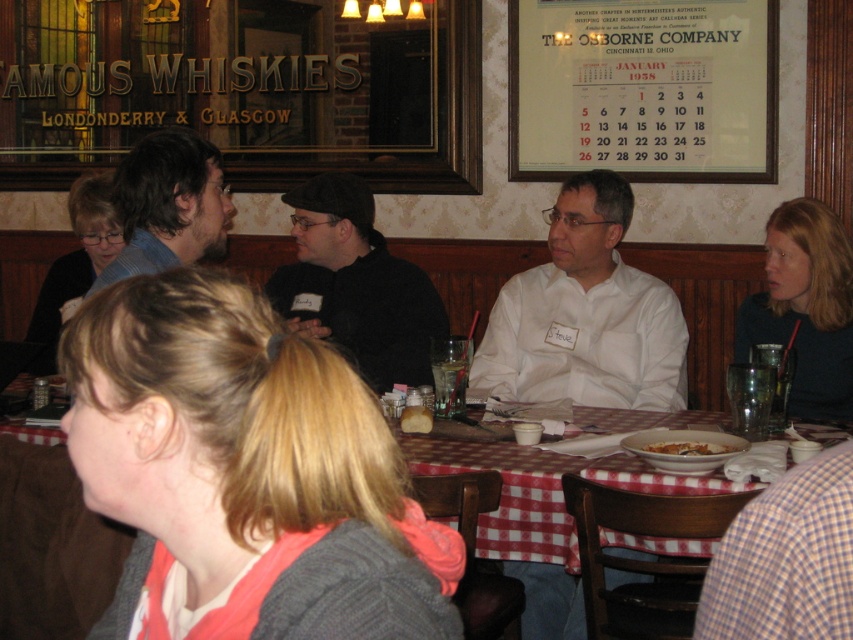
Between point (804, 308) and point (148, 172), which one is positioned in front?

Positioned in front is point (148, 172).

Is point (791, 200) closer to viewer compared to point (151, 266)?

That is False.

Where is `dark blue sweater at right`? This screenshot has height=640, width=853. dark blue sweater at right is located at coordinates (805, 307).

Is red checkered tablecloth at center positioned before white matte bowl at center?

Yes, it is.

Locate an element on the screen. This screenshot has height=640, width=853. red checkered tablecloth at center is located at coordinates (544, 492).

Who is higher up, dark blue sweater at right or white creamy soup at center?

dark blue sweater at right is higher up.

Can you confirm if dark blue sweater at right is wider than white creamy soup at center?

Correct, the width of dark blue sweater at right exceeds that of white creamy soup at center.

Which is in front, point (788, 232) or point (664, 442)?

Point (664, 442) is more forward.

Identify the location of dark blue sweater at right. (805, 307).